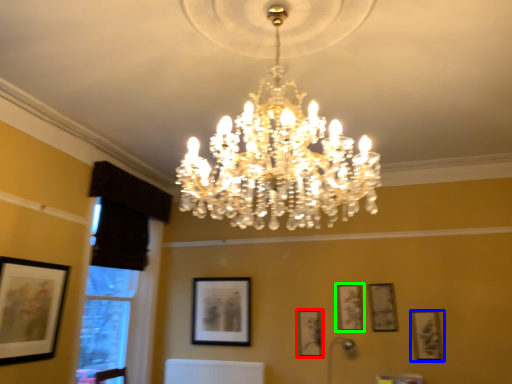
Question: Estimate the real-world distances between objects in this image. Which object is farther from picture frame (highlighted by a red box), picture frame (highlighted by a blue box) or picture frame (highlighted by a green box)?

Choices:
 (A) picture frame
 (B) picture frame

Answer: (A)